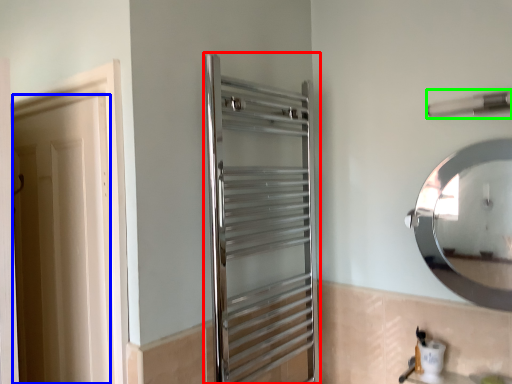
Question: Considering the real-world distances, which object is farthest from screen door (highlighted by a red box)? door (highlighted by a blue box) or towel bar (highlighted by a green box)?

Choices:
 (A) door
 (B) towel bar

Answer: (B)